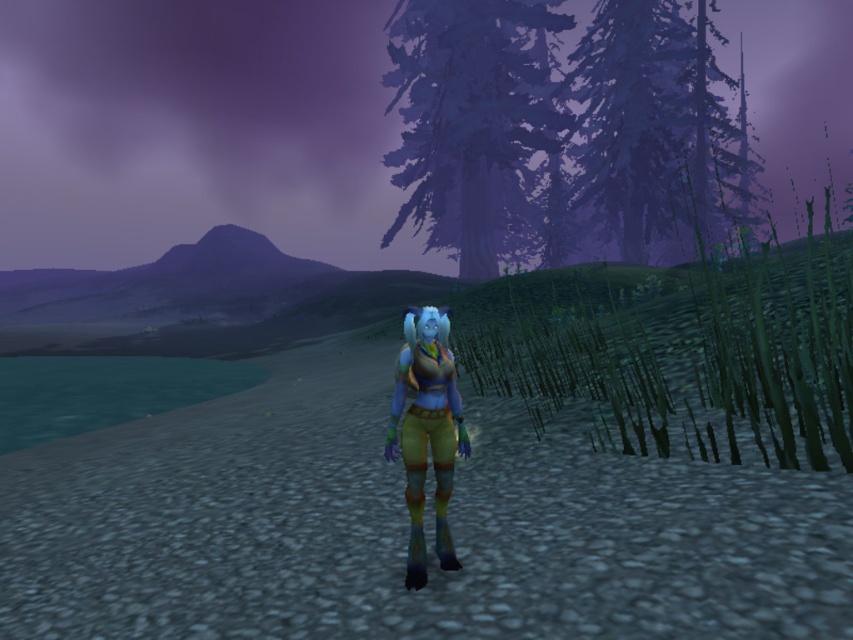
You are a traveler navigating through this magical twilight landscape. You need to determine which tree is closer to you based on their sizes. Which tree would you say is closer, the purple matte tree at upper center or the dark blue textured pine tree at upper right?

The purple matte tree at upper center has a smaller size compared to the dark blue textured pine tree at upper right. Since smaller objects in the distance appear smaller, the purple matte tree at upper center is likely farther away, making the dark blue textured pine tree at upper right closer to you.

You are a traveler in this game environment and need to find the tallest tree to climb for a better view. Which tree should you choose between the purple matte tree at upper center and the dark blue textured pine tree at upper right?

The dark blue textured pine tree at upper right is taller than the purple matte tree at upper center, so you should choose the dark blue textured pine tree at upper right to climb for a better view.